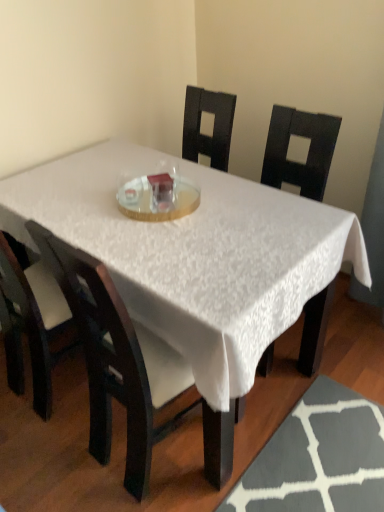
You are a GUI agent. You are given a task and a screenshot of the screen. Output one action in this format:
    pyautogui.click(x=<x>, y=<y>)
    Task: Click on the free space to the back side of clear glass plate at center
    The image size is (384, 512).
    Given the screenshot: What is the action you would take?
    pyautogui.click(x=143, y=168)